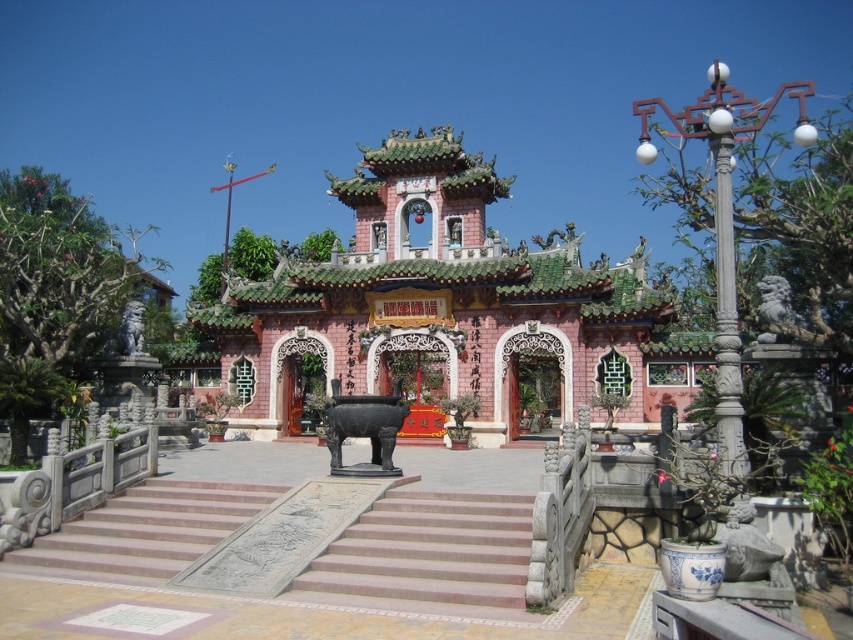
You are a visitor standing at the bottom of the smooth stone stairs at center, looking up at the pink stone temple at center. Which object appears larger in your view?

The pink stone temple at center appears larger in your view because it is bigger than the smooth stone stairs at center.

You are a visitor standing at the bottom of the stone steps looking up at the temple and the pillar. Which object is closer to you, the pink stone temple at center or the white carved stone pillar at right?

The white carved stone pillar at right is closer to you because the pink stone temple at center is positioned under it, meaning the pillar is in front of the temple from your viewpoint.

You are a visitor standing at the bottom of the stone steps leading to the pink stone temple at center. You want to place a small offering on the black polished elephant at center. Can you reach it without climbing the steps?

The pink stone temple at center is positioned over the black polished elephant at center, so the elephant is underneath the temple. Since you are at the bottom of the steps, you can reach the elephant without climbing the steps as it is located below the temple.